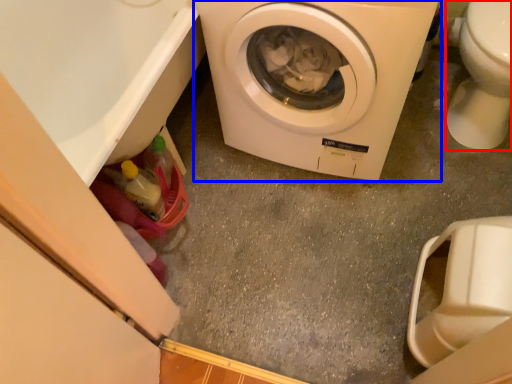
Question: Which point is further to the camera, toilet bowl (highlighted by a red box) or washing machine (highlighted by a blue box)?

Choices:
 (A) toilet bowl
 (B) washing machine

Answer: (A)